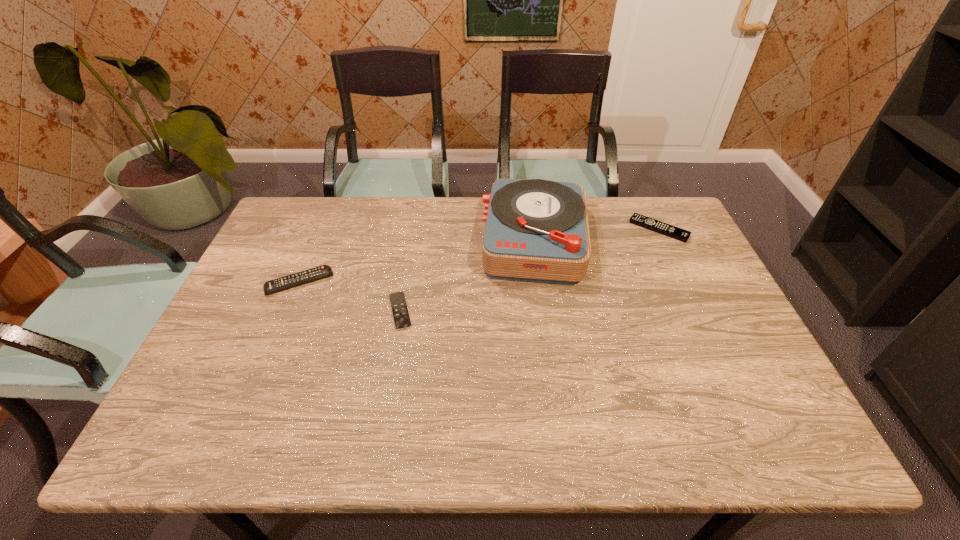
Identify the location of free space at the far left corner of the desktop. (281, 235).

The image size is (960, 540). In the image, there is a desktop. Find the location of `vacant space at the far right corner`. vacant space at the far right corner is located at coordinates (674, 219).

In the image, there is a desktop. At what (x,y) coordinates should I click in order to perform the action: click on free region at the near right corner. Please return your answer as a coordinate pair (x, y). The image size is (960, 540). Looking at the image, I should click on (730, 421).

Locate an element on the screen. free space between the third object from left to right and the second tallest object is located at coordinates (417, 261).

What are the coordinates of `free space between the second shortest object and the record player` in the screenshot? It's located at (597, 234).

You are a GUI agent. You are given a task and a screenshot of the screen. Output one action in this format:
    pyautogui.click(x=<x>, y=<y>)
    Task: Click on the vacant point located between the tallest object and the farthest remote control
    
    Given the screenshot: What is the action you would take?
    pyautogui.click(x=597, y=234)

I want to click on vacant region between the second object from left to right and the leftmost object, so click(349, 296).

Locate an element on the screen. Image resolution: width=960 pixels, height=540 pixels. blank region between the leftmost remote control and the shortest object is located at coordinates (349, 296).

Identify the location of unoccupied area between the second shortest remote control and the third object from left to right. The height and width of the screenshot is (540, 960). (597, 234).

Locate an element on the screen. The width and height of the screenshot is (960, 540). blank region between the second remote control from right to left and the record player is located at coordinates (468, 275).